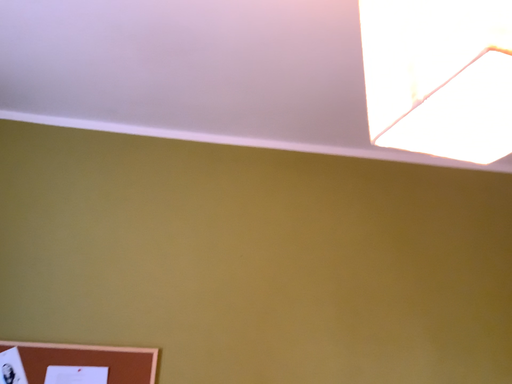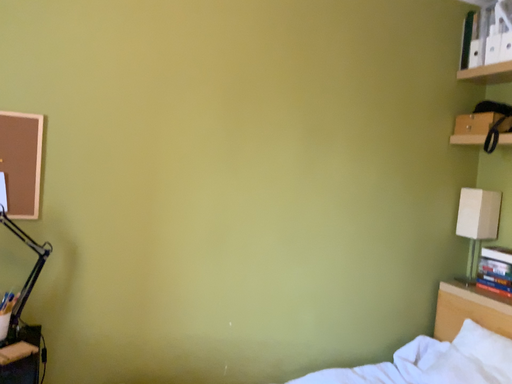
Question: Which way did the camera rotate in the video?

Choices:
 (A) rotated downward
 (B) rotated upward

Answer: (A)